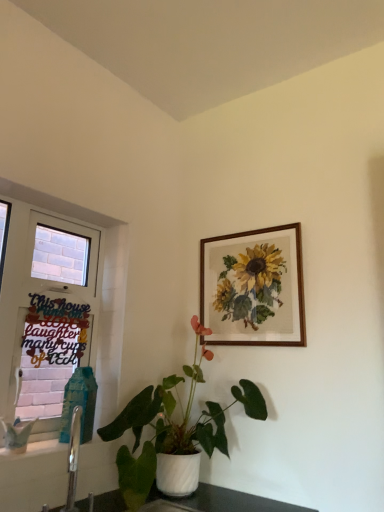
Question: Does white glossy pot at center appear on the left side of black paper sign at left?

Choices:
 (A) yes
 (B) no

Answer: (B)

Question: Can you see white glossy pot at center touching black paper sign at left?

Choices:
 (A) yes
 (B) no

Answer: (B)

Question: Is black paper sign at left surrounded by white glossy pot at center?

Choices:
 (A) yes
 (B) no

Answer: (B)

Question: Is white glossy pot at center facing away from black paper sign at left?

Choices:
 (A) yes
 (B) no

Answer: (A)

Question: Would you say white glossy pot at center is a long distance from black paper sign at left?

Choices:
 (A) no
 (B) yes

Answer: (B)

Question: Considering their positions, is white glossy pot at center located in front of or behind white painted wood window at left?

Choices:
 (A) behind
 (B) front

Answer: (B)

Question: Visually, is white glossy pot at center positioned to the left or to the right of white painted wood window at left?

Choices:
 (A) left
 (B) right

Answer: (B)

Question: Is point (150, 404) positioned closer to the camera than point (31, 320)?

Choices:
 (A) farther
 (B) closer

Answer: (B)

Question: From a real-world perspective, is white glossy pot at center above or below white painted wood window at left?

Choices:
 (A) above
 (B) below

Answer: (B)

Question: Is white painted wood window at left inside or outside of white glossy pot at center?

Choices:
 (A) outside
 (B) inside

Answer: (A)

Question: From their relative heights in the image, would you say white painted wood window at left is taller or shorter than white glossy pot at center?

Choices:
 (A) tall
 (B) short

Answer: (A)

Question: Is white painted wood window at left to the left or to the right of white glossy pot at center in the image?

Choices:
 (A) right
 (B) left

Answer: (B)

Question: From a real-world perspective, relative to white glossy pot at center, is white painted wood window at left vertically above or below?

Choices:
 (A) above
 (B) below

Answer: (A)

Question: In terms of height, does black paper sign at left look taller or shorter compared to white painted wood window at left?

Choices:
 (A) short
 (B) tall

Answer: (A)

Question: Looking at their shapes, would you say black paper sign at left is wider or thinner than white painted wood window at left?

Choices:
 (A) wide
 (B) thin

Answer: (B)